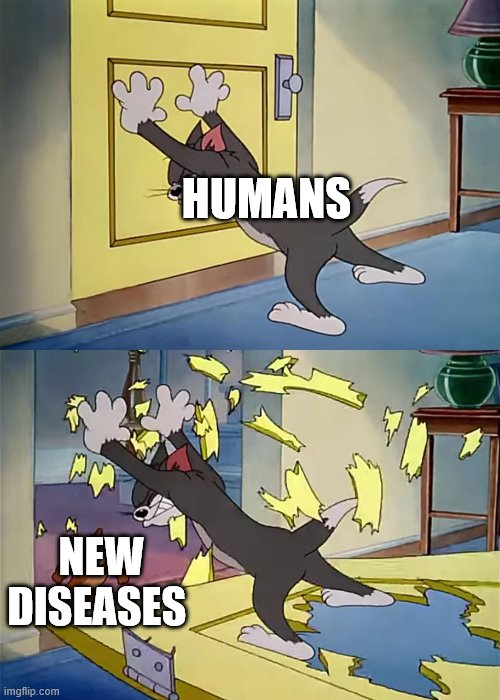
Locate an element on the screen. door closed is located at coordinates (195, 40).